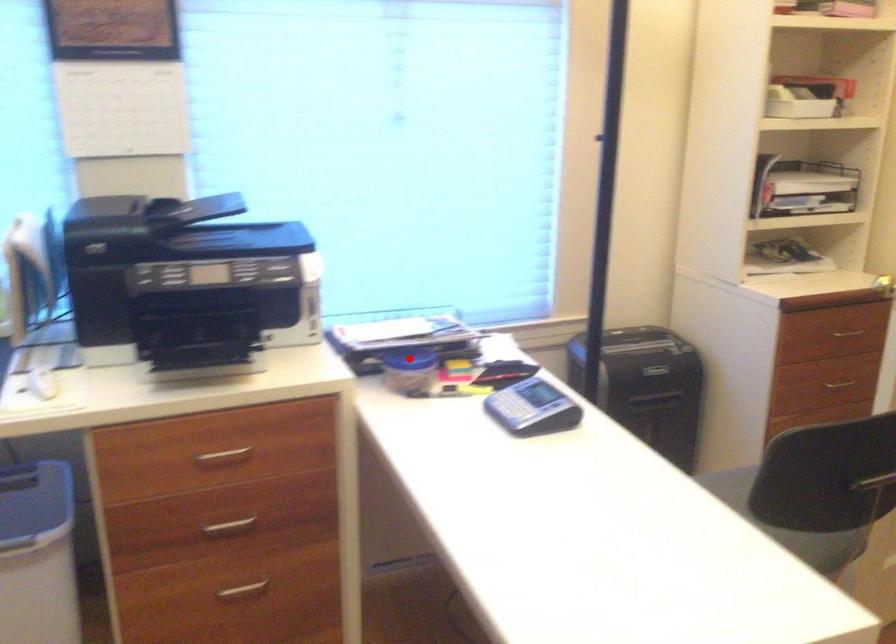
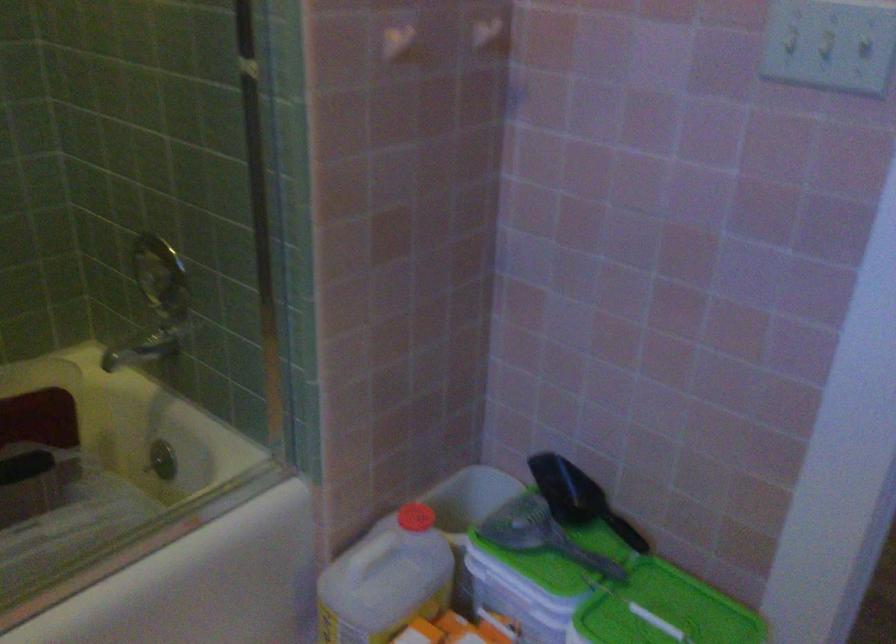
Question: I am providing you with two images of the same scene from different viewpoints. A red point is marked on the first image. Is the red point's position out of view in image 2?

Choices:
 (A) Yes
 (B) No

Answer: (A)